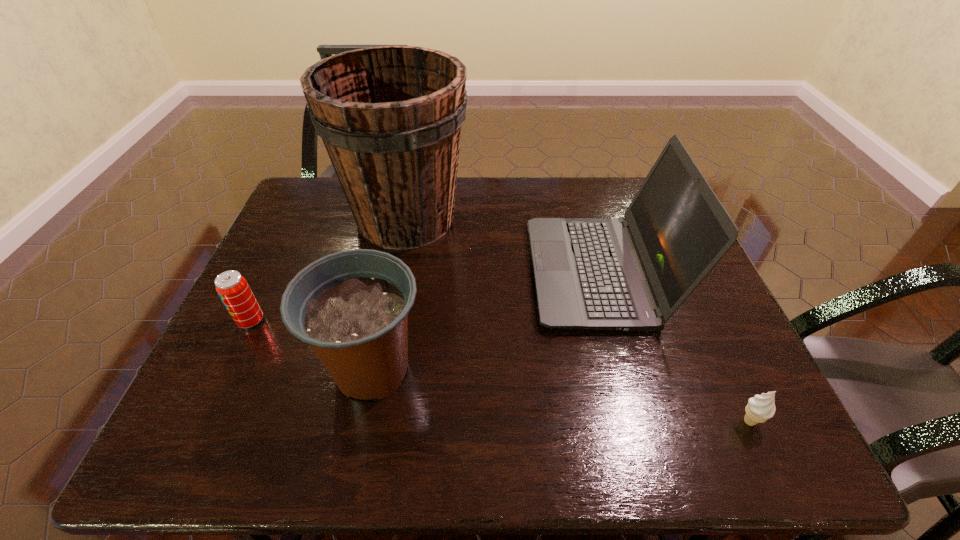
This screenshot has width=960, height=540. Identify the location of object that is at the near right corner. (760, 408).

You are a GUI agent. You are given a task and a screenshot of the screen. Output one action in this format:
    pyautogui.click(x=<x>, y=<y>)
    Task: Click on the free space at the far edge of the desktop
    
    Given the screenshot: What is the action you would take?
    pyautogui.click(x=590, y=205)

In the image, there is a desktop. At what (x,y) coordinates should I click in order to perform the action: click on vacant area at the near edge. Please return your answer as a coordinate pair (x, y). The image size is (960, 540). Looking at the image, I should click on (452, 440).

Identify the location of vacant space at the left edge of the desktop. point(266,283).

The image size is (960, 540). What are the coordinates of `blank space at the right edge of the desktop` in the screenshot? It's located at (750, 396).

Locate an element on the screen. free space at the far left corner of the desktop is located at coordinates point(314,193).

Where is `free space at the near left corner of the desktop`? The width and height of the screenshot is (960, 540). free space at the near left corner of the desktop is located at coordinates pyautogui.click(x=236, y=433).

Where is `vacant area at the far right corner of the desktop`? Image resolution: width=960 pixels, height=540 pixels. vacant area at the far right corner of the desktop is located at coordinates (619, 198).

This screenshot has width=960, height=540. In order to click on unoccupied position between the icecream and the second tallest object in this screenshot , I will do `click(674, 347)`.

This screenshot has height=540, width=960. I want to click on vacant space that is in between the laptop_computer and the third shortest object, so click(x=486, y=321).